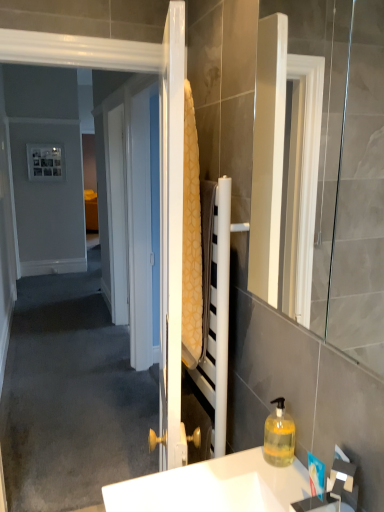
Identify the location of vacant region to the left of translucent yellow liquid at lower right. (222, 472).